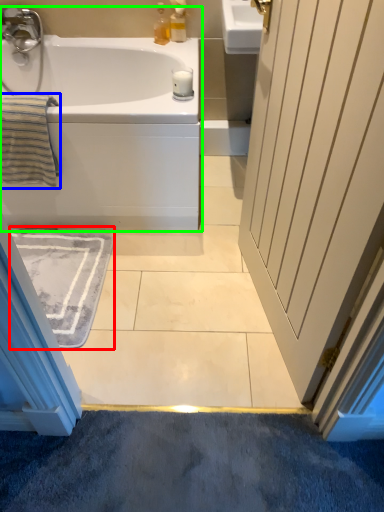
Question: Considering the real-world distances, which object is closest to bath mat (highlighted by a red box)? bath towel (highlighted by a blue box) or bathtub (highlighted by a green box).

Choices:
 (A) bath towel
 (B) bathtub

Answer: (B)